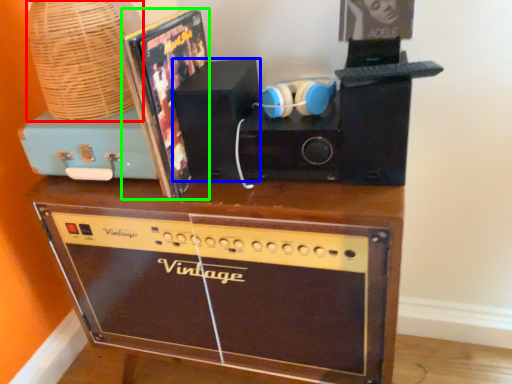
Question: Based on their relative distances, which object is nearer to basket (highlighted by a red box)? Choose from speaker (highlighted by a blue box) and album cover (highlighted by a green box).

Choices:
 (A) speaker
 (B) album cover

Answer: (B)